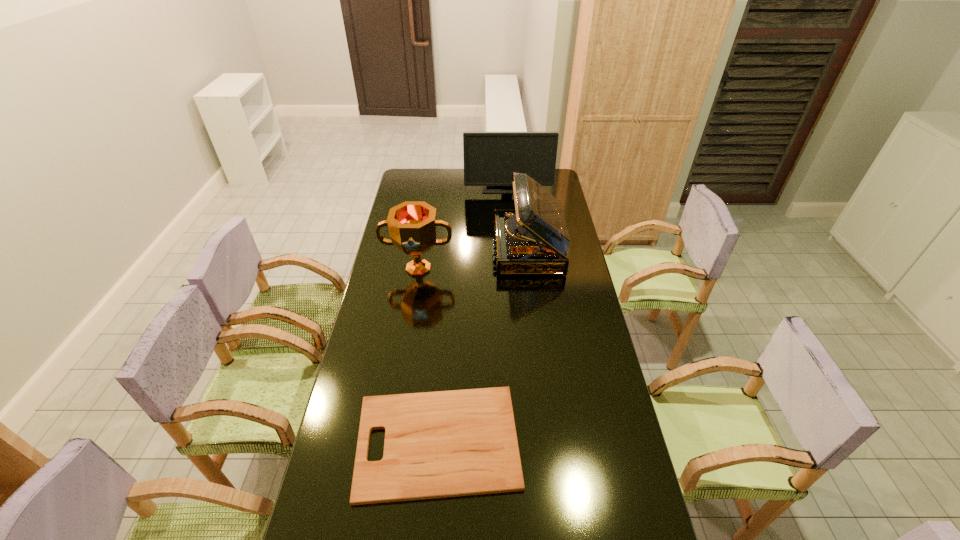
Locate which object ranks third in proximity to the farthest object. Please provide its 2D coordinates. Your answer should be formatted as a tuple, i.e. [(x, y)], where the tuple contains the x and y coordinates of a point satisfying the conditions above.

[(440, 444)]

This screenshot has height=540, width=960. I want to click on vacant space that satisfies the following two spatial constraints: 1. on the side of the shortest object with the star emblem; 2. on the right side of the award, so click(x=391, y=442).

I want to click on vacant point that satisfies the following two spatial constraints: 1. on the front-facing side of the record player; 2. on the side of the award with the star emblem, so click(531, 269).

The image size is (960, 540). What are the coordinates of `vacant region that satisfies the following two spatial constraints: 1. on the front-facing side of the record player; 2. on the side of the award with the star emblem` in the screenshot? It's located at (531, 269).

Image resolution: width=960 pixels, height=540 pixels. I want to click on vacant space that satisfies the following two spatial constraints: 1. on the front-facing side of the record player; 2. on the side of the award with the star emblem, so click(x=531, y=269).